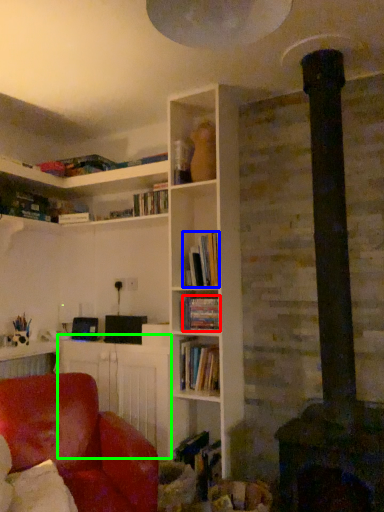
Question: Considering the real-world distances, which object is closest to book (highlighted by a red box)? book (highlighted by a blue box) or table (highlighted by a green box).

Choices:
 (A) book
 (B) table

Answer: (A)